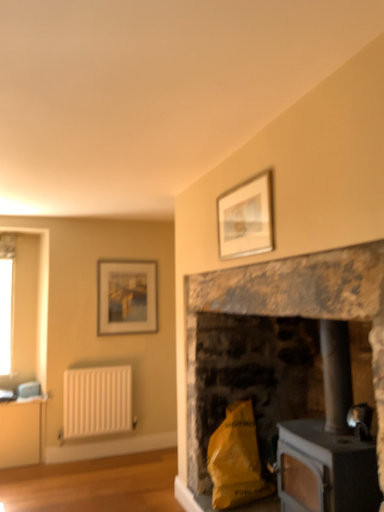
Question: Based on their positions, is matte silver picture frame at upper center, which is the first picture frame from front to back, located to the left or right of black matte wood burning stove at lower right?

Choices:
 (A) left
 (B) right

Answer: (A)

Question: Choose the correct answer: Is matte silver picture frame at upper center, arranged as the second picture frame when viewed from the left, inside black matte wood burning stove at lower right or outside it?

Choices:
 (A) outside
 (B) inside

Answer: (A)

Question: Estimate the real-world distances between objects in this image. Which object is farther from the rustic stone fireplace at center?

Choices:
 (A) matte wooden picture frame at upper left, which appears as the first picture frame when viewed from the back
 (B) yellow paper bag at lower center
 (C) black matte wood burning stove at lower right
 (D) white textured radiator at left
 (E) matte silver picture frame at upper center, the 1th picture frame when ordered from top to bottom

Answer: (A)

Question: Which object is the farthest from the matte wooden picture frame at upper left, acting as the first picture frame starting from the left?

Choices:
 (A) yellow paper bag at lower center
 (B) white textured radiator at left
 (C) matte silver picture frame at upper center, the second picture frame when ordered from bottom to top
 (D) black matte wood burning stove at lower right
 (E) rustic stone fireplace at center

Answer: (D)